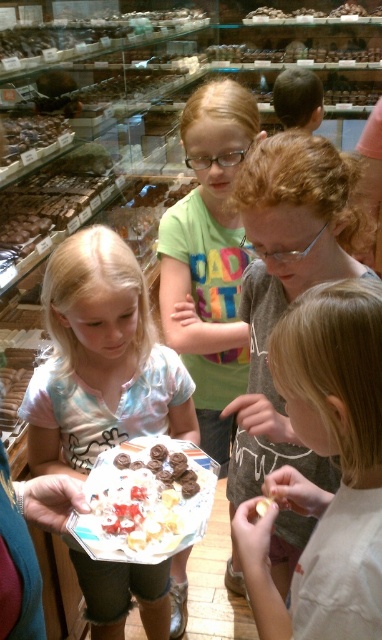
The height and width of the screenshot is (640, 382). Describe the element at coordinates (100, 360) in the screenshot. I see `pastel tie-dye shirt at center` at that location.

Which is more to the right, pastel tie-dye shirt at center or white creamy cake at center?

white creamy cake at center

Where is `pastel tie-dye shirt at center`? The image size is (382, 640). pastel tie-dye shirt at center is located at coordinates (100, 360).

Image resolution: width=382 pixels, height=640 pixels. I want to click on pastel tie-dye shirt at center, so click(100, 360).

Between point (318, 445) and point (173, 209), which one is positioned behind?

Positioned behind is point (173, 209).

At what (x,y) coordinates should I click in order to perform the action: click on light brown hair at center. Please return your answer as a coordinate pair (x, y). Looking at the image, I should click on (328, 456).

Can you confirm if light brown hair at center is positioned to the left of pastel tie-dye shirt at center?

No, light brown hair at center is not to the left of pastel tie-dye shirt at center.

This screenshot has height=640, width=382. What do you see at coordinates (328, 456) in the screenshot?
I see `light brown hair at center` at bounding box center [328, 456].

Between point (354, 536) and point (118, 625), which one is positioned in front?

Point (354, 536) is in front.

Where is `light brown hair at center`? light brown hair at center is located at coordinates (328, 456).